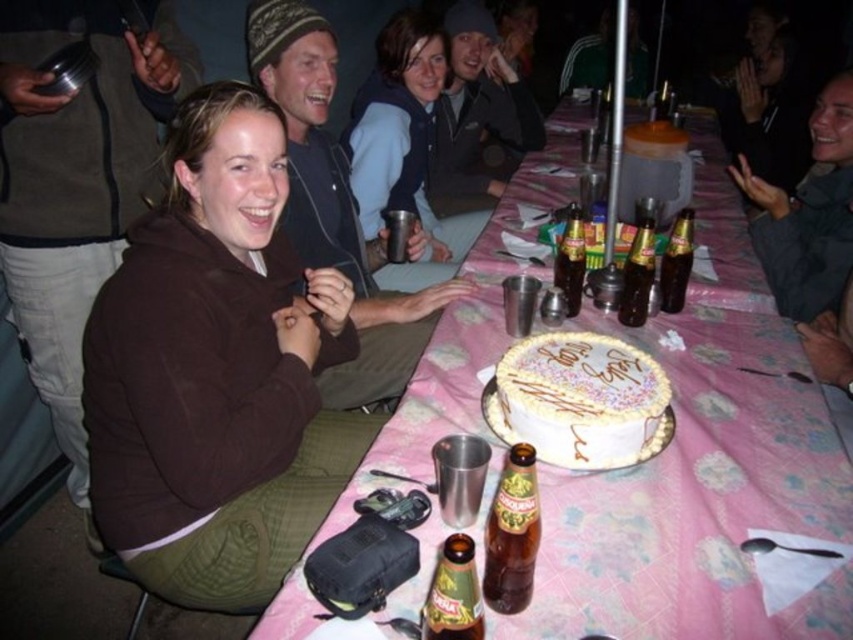
Between matte blue jacket at center and brown glass bottle at lower center, which one appears on the left side from the viewer's perspective?

Positioned to the left is matte blue jacket at center.

Is the position of matte blue jacket at center less distant than that of brown glass bottle at lower center?

No, it is behind brown glass bottle at lower center.

Locate an element on the screen. This screenshot has width=853, height=640. matte blue jacket at center is located at coordinates pyautogui.click(x=404, y=148).

The image size is (853, 640). I want to click on matte blue jacket at center, so click(404, 148).

How far apart are pink floral tablecloth at center and brown glass bottle at lower center?

17.83 inches

Which is behind, point (846, 534) or point (534, 458)?

Positioned behind is point (846, 534).

What do you see at coordinates (700, 472) in the screenshot?
I see `pink floral tablecloth at center` at bounding box center [700, 472].

The height and width of the screenshot is (640, 853). In order to click on pink floral tablecloth at center in this screenshot , I will do `click(700, 472)`.

Does point (506, 602) come farther from viewer compared to point (451, 620)?

Yes, point (506, 602) is farther from viewer.

Can you confirm if brown glass bottle at lower center is smaller than green glass bottle at center?

No, brown glass bottle at lower center is not smaller than green glass bottle at center.

Who is more distant from viewer, (494, 554) or (432, 608)?

Point (494, 554)

Where is `brown glass bottle at lower center`? This screenshot has width=853, height=640. brown glass bottle at lower center is located at coordinates (512, 532).